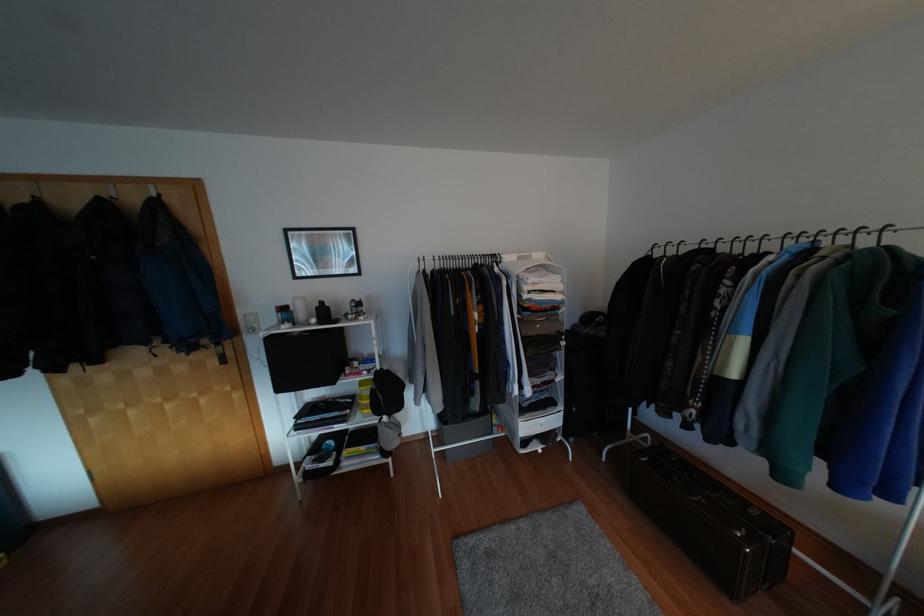
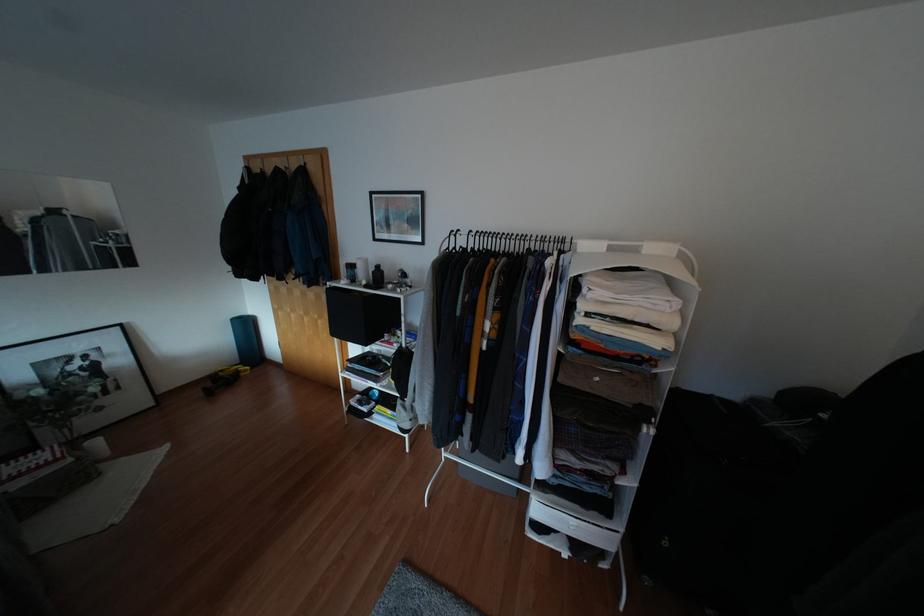
Locate, in the second image, the point that corresponds to (x=371, y=376) in the first image.

(394, 351)